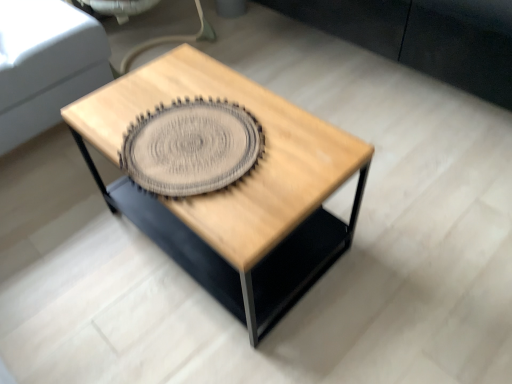
Question: Should I look upward or downward to see natural wood coffee table at center?

Choices:
 (A) up
 (B) down

Answer: (A)